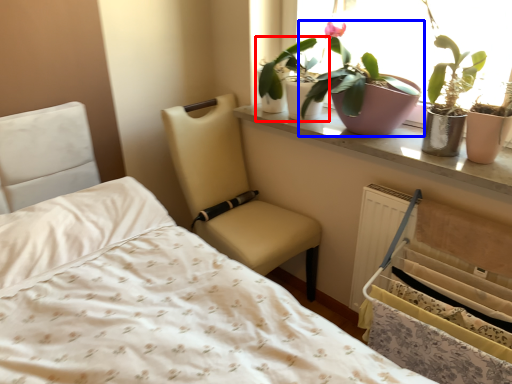
Question: Which object is closer to the camera taking this photo, houseplant (highlighted by a red box) or houseplant (highlighted by a blue box)?

Choices:
 (A) houseplant
 (B) houseplant

Answer: (B)